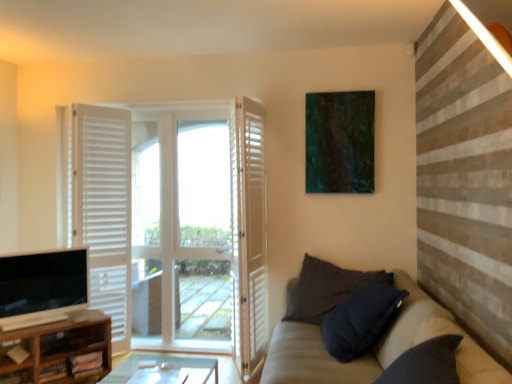
Question: Should I look upward or downward to see white wooden door at center, the 3th door when ordered from left to right?

Choices:
 (A) down
 (B) up

Answer: (A)

Question: Would you say beige fabric couch at lower right contains white wooden door at left, acting as the 3th door starting from the right?

Choices:
 (A) yes
 (B) no

Answer: (B)

Question: Is beige fabric couch at lower right closer to camera compared to white wooden door at left, acting as the 3th door starting from the right?

Choices:
 (A) yes
 (B) no

Answer: (A)

Question: From a real-world perspective, is beige fabric couch at lower right positioned under white wooden door at left, acting as the 3th door starting from the right, based on gravity?

Choices:
 (A) no
 (B) yes

Answer: (B)

Question: Is beige fabric couch at lower right positioned with its back to white wooden door at left, the first door when ordered from left to right?

Choices:
 (A) no
 (B) yes

Answer: (A)

Question: From a real-world perspective, is beige fabric couch at lower right on white wooden door at left, the first door when ordered from left to right?

Choices:
 (A) yes
 (B) no

Answer: (B)

Question: Is beige fabric couch at lower right taller than white wooden door at left, the first door when ordered from left to right?

Choices:
 (A) yes
 (B) no

Answer: (B)

Question: From the image's perspective, is white wooden door at left, acting as the 3th door starting from the right, on matte black tv at lower left?

Choices:
 (A) yes
 (B) no

Answer: (A)

Question: Can you confirm if white wooden door at left, acting as the 3th door starting from the right, is thinner than matte black tv at lower left?

Choices:
 (A) no
 (B) yes

Answer: (A)

Question: Considering the relative positions of white wooden door at left, acting as the 3th door starting from the right, and matte black tv at lower left in the image provided, is white wooden door at left, acting as the 3th door starting from the right, to the right of matte black tv at lower left from the viewer's perspective?

Choices:
 (A) yes
 (B) no

Answer: (A)

Question: Considering the relative sizes of white wooden door at left, the first door when ordered from left to right, and matte black tv at lower left in the image provided, is white wooden door at left, the first door when ordered from left to right, shorter than matte black tv at lower left?

Choices:
 (A) yes
 (B) no

Answer: (B)

Question: Are white wooden door at left, the first door when ordered from left to right, and matte black tv at lower left located far from each other?

Choices:
 (A) no
 (B) yes

Answer: (A)

Question: Considering the relative positions of white wooden door at left, the first door when ordered from left to right, and matte black tv at lower left in the image provided, is white wooden door at left, the first door when ordered from left to right, to the left of matte black tv at lower left from the viewer's perspective?

Choices:
 (A) yes
 (B) no

Answer: (B)

Question: Would you say dark textured pillow at lower right is a long distance from beige fabric couch at lower right?

Choices:
 (A) yes
 (B) no

Answer: (B)